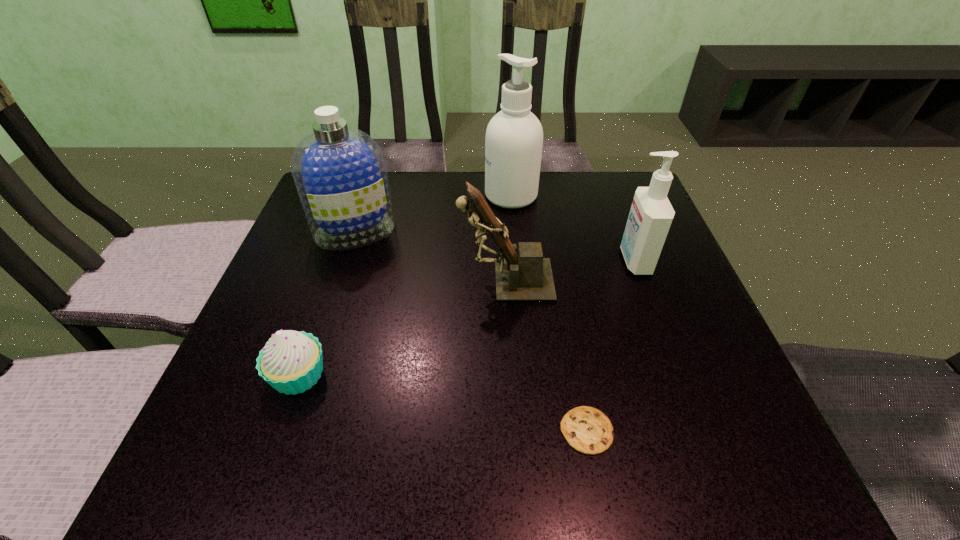
The height and width of the screenshot is (540, 960). I want to click on free region located on the left of the shortest object, so click(x=516, y=430).

Identify the location of object positioned at the near edge. The width and height of the screenshot is (960, 540). (588, 430).

Find the location of a particular element. This screenshot has width=960, height=540. cleansing agent located in the left edge section of the desktop is located at coordinates (339, 172).

You are a GUI agent. You are given a task and a screenshot of the screen. Output one action in this format:
    pyautogui.click(x=<x>, y=<y>)
    Task: Click on the cupcake present at the left edge
    The height and width of the screenshot is (540, 960).
    Given the screenshot: What is the action you would take?
    pyautogui.click(x=291, y=362)

The image size is (960, 540). What are the coordinates of `object positioned at the right edge` in the screenshot? It's located at (651, 214).

Locate an element on the screen. Image resolution: width=960 pixels, height=540 pixels. object that is at the far left corner is located at coordinates (339, 172).

Locate an element on the screen. vacant position at the far edge of the desktop is located at coordinates (540, 181).

You are a GUI agent. You are given a task and a screenshot of the screen. Output one action in this format:
    pyautogui.click(x=<x>, y=<y>)
    Task: Click on the free space at the near edge
    
    Given the screenshot: What is the action you would take?
    pyautogui.click(x=321, y=465)

Identify the location of vacant area at the left edge of the desktop. This screenshot has width=960, height=540. (277, 280).

Image resolution: width=960 pixels, height=540 pixels. What are the coordinates of `vacant space at the right edge of the desktop` in the screenshot? It's located at (730, 413).